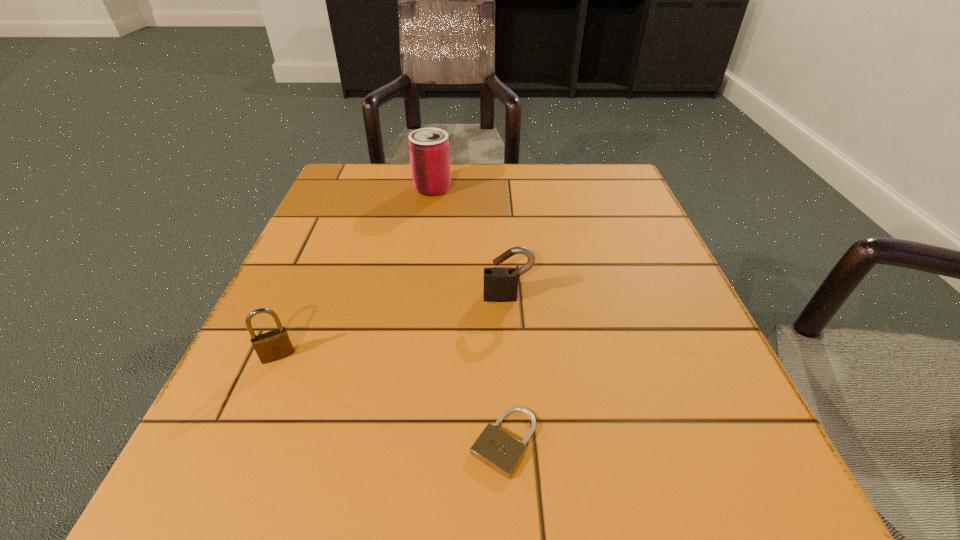
At what (x,y) coordinates should I click in order to perform the action: click on vacant space located on the left of the shortest padlock. Please return your answer as a coordinate pair (x, y). Looking at the image, I should click on (391, 442).

This screenshot has width=960, height=540. What are the coordinates of `object that is at the far edge` in the screenshot? It's located at (429, 148).

You are a GUI agent. You are given a task and a screenshot of the screen. Output one action in this format:
    pyautogui.click(x=<x>, y=<y>)
    Task: Click on the object positioned at the near edge
    
    Given the screenshot: What is the action you would take?
    pyautogui.click(x=495, y=448)

The image size is (960, 540). What are the coordinates of `object located in the left edge section of the desktop` in the screenshot? It's located at (274, 345).

Locate an element on the screen. Image resolution: width=960 pixels, height=540 pixels. vacant space at the far edge is located at coordinates (422, 195).

At what (x,y) coordinates should I click in order to perform the action: click on vacant area at the near edge. Please return your answer as a coordinate pair (x, y). Looking at the image, I should click on (623, 471).

This screenshot has width=960, height=540. In order to click on vacant space at the left edge in this screenshot , I will do `click(373, 246)`.

Image resolution: width=960 pixels, height=540 pixels. Identify the location of vacant space at the right edge of the desktop. 624,241.

Identify the location of free space at the far left corner. The height and width of the screenshot is (540, 960). 342,206.

You are a GUI agent. You are given a task and a screenshot of the screen. Output one action in this format:
    pyautogui.click(x=<x>, y=<y>)
    Task: Click on the vacant region at the near left corner
    
    Given the screenshot: What is the action you would take?
    pyautogui.click(x=198, y=472)